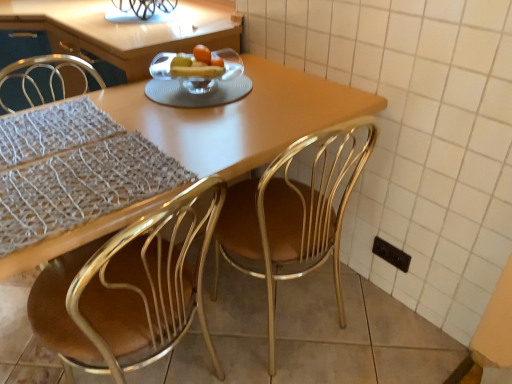
Where is `free space to the right of metallic gold chair at center, which is counted as the 2th chair, starting from the left`? Image resolution: width=512 pixels, height=384 pixels. free space to the right of metallic gold chair at center, which is counted as the 2th chair, starting from the left is located at coordinates (378, 332).